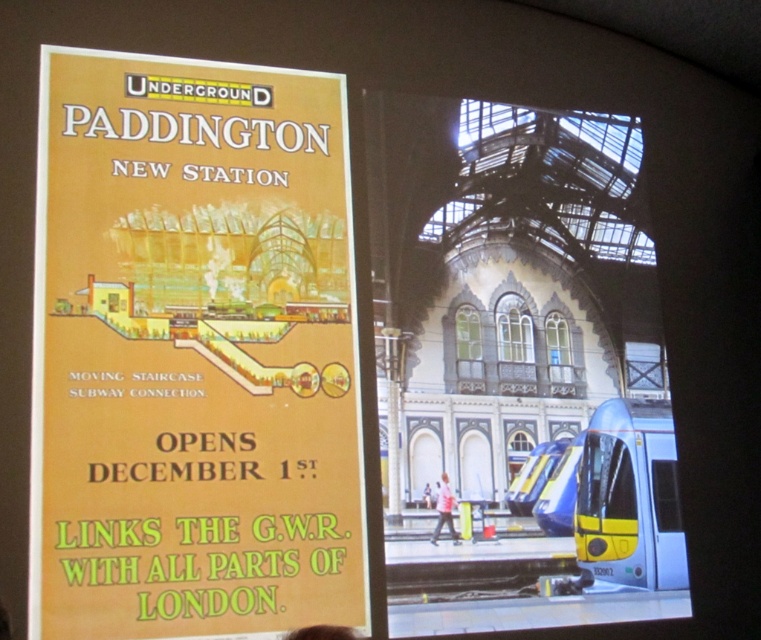
Does blue/yellow metal train at center appear under white fabric at center?

Actually, blue/yellow metal train at center is above white fabric at center.

Between blue/yellow metal train at center and white fabric at center, which one has less height?

With less height is white fabric at center.

You are a GUI agent. You are given a task and a screenshot of the screen. Output one action in this format:
    pyautogui.click(x=<x>, y=<y>)
    Task: Click on the blue/yellow metal train at center
    Image resolution: width=761 pixels, height=640 pixels.
    Given the screenshot: What is the action you would take?
    pyautogui.click(x=502, y=349)

Locate an element on the screen. Image resolution: width=761 pixels, height=640 pixels. blue/yellow metal train at center is located at coordinates (502, 349).

Is matte yellow poster at upper left taller than white fabric at center?

Correct, matte yellow poster at upper left is much taller as white fabric at center.

Does point (56, 252) lie in front of point (457, 534)?

Yes.

Find the location of a particular element. matte yellow poster at upper left is located at coordinates (193, 353).

Between point (256, 458) and point (482, 120), which one is positioned behind?

Point (482, 120)

Between matte yellow poster at upper left and blue/yellow metal train at center, which one appears on the left side from the viewer's perspective?

matte yellow poster at upper left

Which is in front, point (253, 196) or point (594, 161)?

Positioned in front is point (253, 196).

Locate an element on the screen. matte yellow poster at upper left is located at coordinates (193, 353).